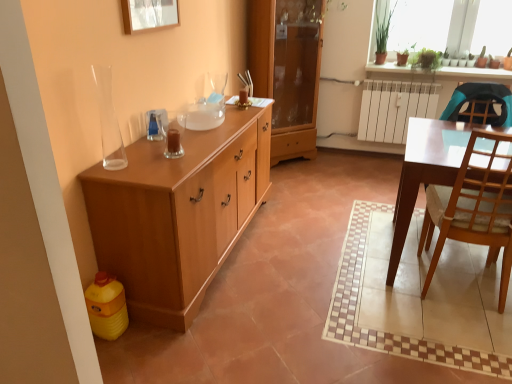
Identify the location of vacant area that is in front of transparent glass sink at center. This screenshot has width=512, height=384. (197, 135).